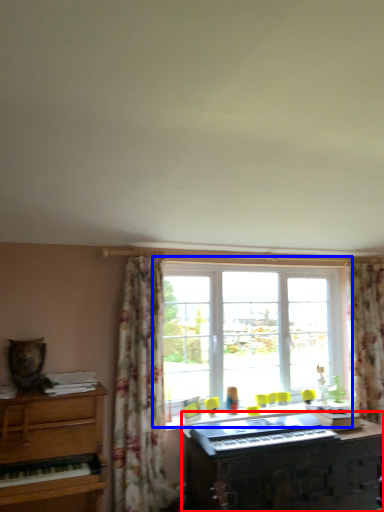
Question: Which object is closer to the camera taking this photo, piano (highlighted by a red box) or window (highlighted by a blue box)?

Choices:
 (A) piano
 (B) window

Answer: (A)